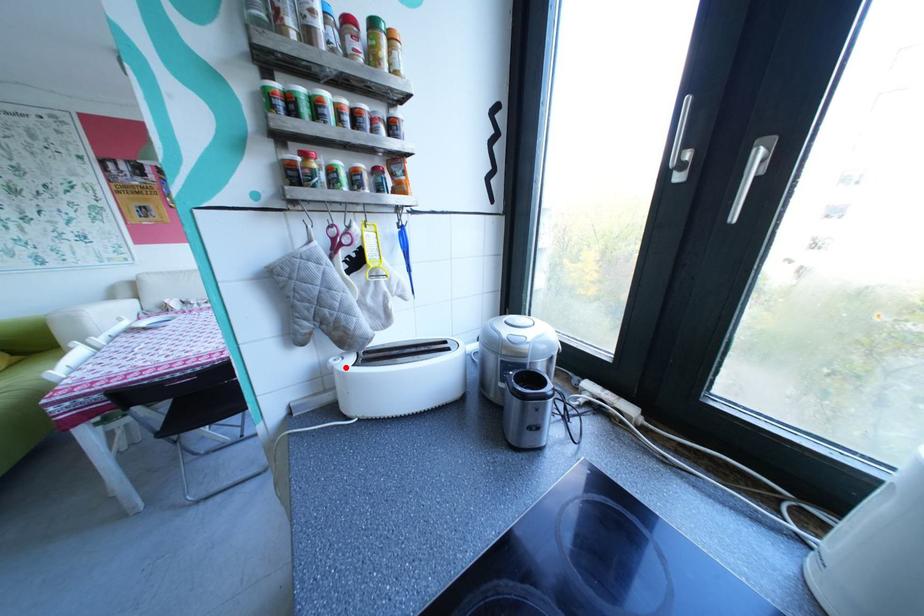
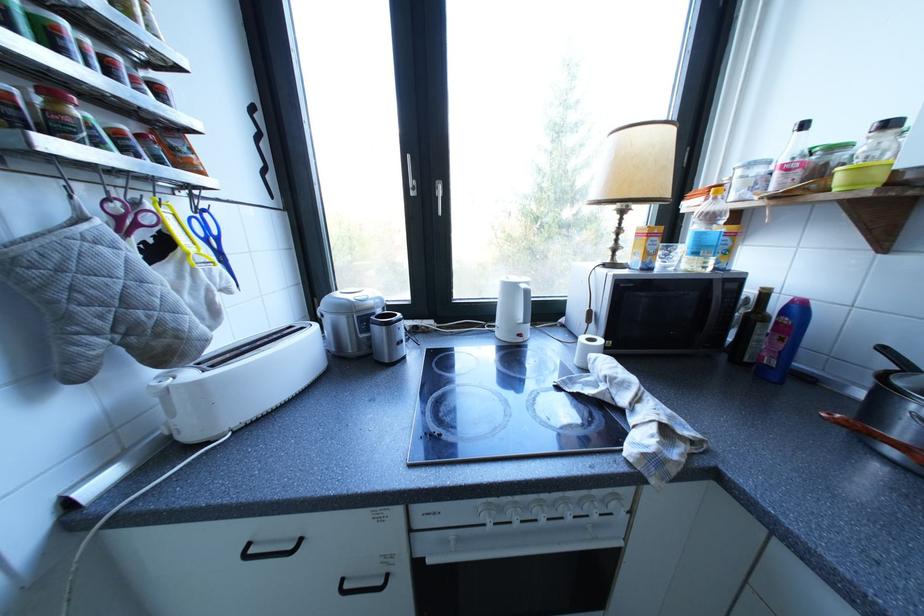
Find the pixel in the second image that matches the highlighted location in the first image.

(179, 387)